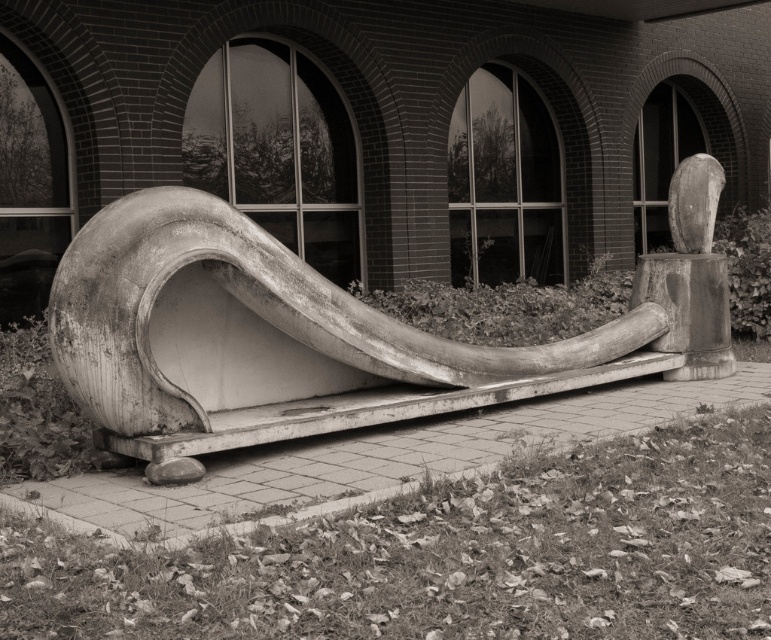
Is smooth concrete slide at center thinner than smooth wood sculpture at center?

Incorrect, smooth concrete slide at center's width is not less than smooth wood sculpture at center's.

Who is shorter, smooth concrete slide at center or smooth wood sculpture at center?

smooth concrete slide at center is shorter.

This screenshot has height=640, width=771. I want to click on smooth concrete slide at center, so click(251, 323).